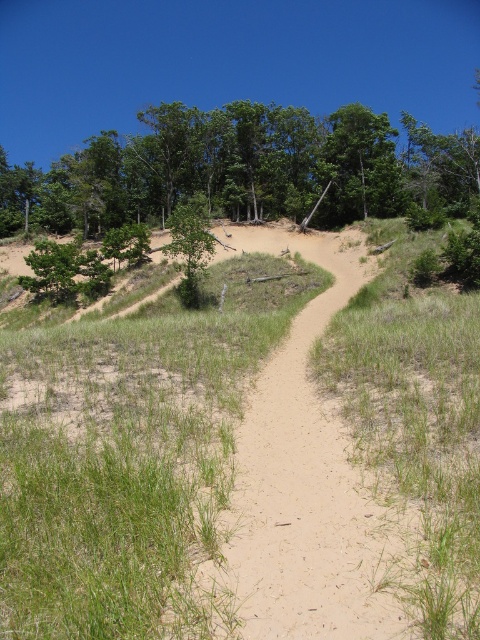
Can you confirm if green grass at center is positioned to the left of green matte tree at center?

No, green grass at center is not to the left of green matte tree at center.

Between green grass at center and green matte tree at center, which one has less height?

With less height is green grass at center.

At what (x,y) coordinates should I click in order to perform the action: click on green grass at center. Please return your answer as a coordinate pair (x, y). The width and height of the screenshot is (480, 640). Looking at the image, I should click on (241, 456).

Between green grass at center and green leafy tree at upper center, which one appears on the right side from the viewer's perspective?

From the viewer's perspective, green leafy tree at upper center appears more on the right side.

Does green grass at center have a lesser width compared to green leafy tree at upper center?

Yes.

Describe the element at coordinates (241, 456) in the screenshot. I see `green grass at center` at that location.

The image size is (480, 640). I want to click on green grass at center, so click(x=241, y=456).

Which of these two, green leafy tree at upper center or green matte tree at center, stands taller?

green leafy tree at upper center

Can you confirm if green leafy tree at upper center is taller than green matte tree at center?

Indeed, green leafy tree at upper center has a greater height compared to green matte tree at center.

Describe the element at coordinates (247, 170) in the screenshot. I see `green leafy tree at upper center` at that location.

The height and width of the screenshot is (640, 480). I want to click on green leafy tree at upper center, so click(247, 170).